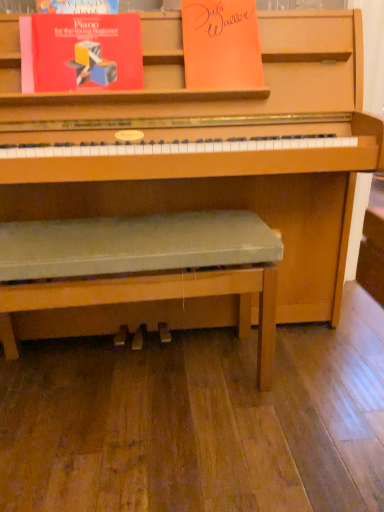
Question: Are orange paper at upper center, arranged as the second paperback book when viewed from the left, and green fabric bench at center beside each other?

Choices:
 (A) no
 (B) yes

Answer: (A)

Question: Can you confirm if orange paper at upper center, the first paperback book positioned from the right, is taller than green fabric bench at center?

Choices:
 (A) no
 (B) yes

Answer: (A)

Question: Considering the relative positions of orange paper at upper center, arranged as the second paperback book when viewed from the left, and green fabric bench at center in the image provided, is orange paper at upper center, arranged as the second paperback book when viewed from the left, in front of green fabric bench at center?

Choices:
 (A) no
 (B) yes

Answer: (A)

Question: From the image's perspective, is orange paper at upper center, arranged as the second paperback book when viewed from the left, above green fabric bench at center?

Choices:
 (A) yes
 (B) no

Answer: (A)

Question: Would you say orange paper at upper center, arranged as the second paperback book when viewed from the left, contains green fabric bench at center?

Choices:
 (A) yes
 (B) no

Answer: (B)

Question: Can you confirm if orange paper at upper center, arranged as the second paperback book when viewed from the left, is shorter than green fabric bench at center?

Choices:
 (A) yes
 (B) no

Answer: (A)

Question: Is green fabric bench at center bigger than matte red book at upper left, which appears as the second paperback book when viewed from the right?

Choices:
 (A) no
 (B) yes

Answer: (B)

Question: Considering the relative sizes of green fabric bench at center and matte red book at upper left, which ranks as the first paperback book in left-to-right order, in the image provided, is green fabric bench at center smaller than matte red book at upper left, which ranks as the first paperback book in left-to-right order,?

Choices:
 (A) yes
 (B) no

Answer: (B)

Question: From a real-world perspective, is green fabric bench at center positioned under matte red book at upper left, which appears as the second paperback book when viewed from the right, based on gravity?

Choices:
 (A) yes
 (B) no

Answer: (A)

Question: Is green fabric bench at center thinner than matte red book at upper left, which appears as the second paperback book when viewed from the right?

Choices:
 (A) no
 (B) yes

Answer: (A)

Question: Considering the relative sizes of green fabric bench at center and matte red book at upper left, which ranks as the first paperback book in left-to-right order, in the image provided, is green fabric bench at center shorter than matte red book at upper left, which ranks as the first paperback book in left-to-right order,?

Choices:
 (A) no
 (B) yes

Answer: (A)

Question: From the image's perspective, is green fabric bench at center on matte red book at upper left, which ranks as the first paperback book in left-to-right order?

Choices:
 (A) yes
 (B) no

Answer: (B)

Question: From the image's perspective, is orange paper at upper center, the first paperback book positioned from the right, located beneath matte red book at upper left, which appears as the second paperback book when viewed from the right?

Choices:
 (A) yes
 (B) no

Answer: (B)